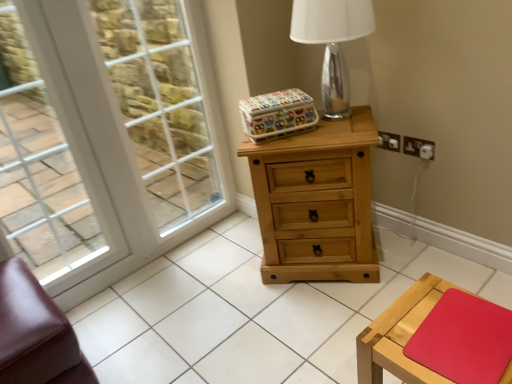
What is the approximate width of natural wood chest of drawers at center?

The width of natural wood chest of drawers at center is 16.77 inches.

This screenshot has width=512, height=384. Find the location of `white plastic electrical outlet at upper right, which is counted as the 1th electric outlet, starting from the right`. white plastic electrical outlet at upper right, which is counted as the 1th electric outlet, starting from the right is located at coordinates (418, 148).

Image resolution: width=512 pixels, height=384 pixels. Describe the element at coordinates (35, 333) in the screenshot. I see `brown leather ottoman at lower left` at that location.

This screenshot has height=384, width=512. What are the coordinates of `wooden table at lower right` in the screenshot? It's located at (400, 335).

At what (x,y) coordinates should I click in order to perform the action: click on natural wood tile at center. Please return your answer as a coordinate pair (x, y). Image resolution: width=512 pixels, height=384 pixels. Looking at the image, I should click on (251, 312).

This screenshot has height=384, width=512. Identify the location of electric outlet on the right of the white plastic electrical outlet at upper right, the 2th electric outlet from the right. (418, 148).

Is white plastic electrical outlet at upper right, the 2th electric outlet from the right, aimed at white plastic electrical outlet at upper right, which is counted as the second electric outlet, starting from the left?

No.

Considering the relative sizes of white plastic electrical outlet at upper right, marked as the first electric outlet in a left-to-right arrangement, and white plastic electrical outlet at upper right, which is counted as the 1th electric outlet, starting from the right, in the image provided, is white plastic electrical outlet at upper right, marked as the first electric outlet in a left-to-right arrangement, shorter than white plastic electrical outlet at upper right, which is counted as the 1th electric outlet, starting from the right,?

No, white plastic electrical outlet at upper right, marked as the first electric outlet in a left-to-right arrangement, is not shorter than white plastic electrical outlet at upper right, which is counted as the 1th electric outlet, starting from the right.

Is white plastic electrical outlet at upper right, the 2th electric outlet from the right, directly adjacent to white plastic electrical outlet at upper right, which is counted as the second electric outlet, starting from the left?

Yes, white plastic electrical outlet at upper right, the 2th electric outlet from the right, and white plastic electrical outlet at upper right, which is counted as the second electric outlet, starting from the left, clearly make contact.

Looking at this image, who is bigger, wooden table at lower right or white plastic electrical outlet at upper right, the 2th electric outlet from the right?

wooden table at lower right is bigger.

Consider the image. From the image's perspective, would you say wooden table at lower right is positioned over white plastic electrical outlet at upper right, the 2th electric outlet from the right?

No, from the image's perspective, wooden table at lower right is not above white plastic electrical outlet at upper right, the 2th electric outlet from the right.

In terms of height, does wooden table at lower right look taller or shorter compared to white plastic electrical outlet at upper right, the 2th electric outlet from the right?

In the image, wooden table at lower right appears to be taller than white plastic electrical outlet at upper right, the 2th electric outlet from the right.

From a real-world perspective, relative to white plastic electrical outlet at upper right, the 2th electric outlet from the right, is wooden table at lower right vertically above or below?

Clearly, from a real-world perspective, wooden table at lower right is below white plastic electrical outlet at upper right, the 2th electric outlet from the right.

Is natural wood tile at center not within white plastic electrical outlet at upper right, marked as the first electric outlet in a left-to-right arrangement?

Absolutely, natural wood tile at center is external to white plastic electrical outlet at upper right, marked as the first electric outlet in a left-to-right arrangement.

From the image's perspective, is natural wood tile at center on top of white plastic electrical outlet at upper right, the 2th electric outlet from the right?

No.

From a real-world perspective, who is located lower, natural wood tile at center or white plastic electrical outlet at upper right, the 2th electric outlet from the right?

In real-world perspective, natural wood tile at center is lower.

Can you confirm if transparent glass table lamp at upper center is wider than white plastic electrical outlet at upper right, the 2th electric outlet from the right?

Yes, transparent glass table lamp at upper center is wider than white plastic electrical outlet at upper right, the 2th electric outlet from the right.

Is transparent glass table lamp at upper center turned away from white plastic electrical outlet at upper right, the 2th electric outlet from the right?

No, white plastic electrical outlet at upper right, the 2th electric outlet from the right, is not at the back of transparent glass table lamp at upper center.

Does point (312, 39) lie in front of point (380, 141)?

That is True.

Are wooden table at lower right and white plastic electrical outlet at upper right, which is counted as the second electric outlet, starting from the left, located far from each other?

That's not correct — wooden table at lower right is a little close to white plastic electrical outlet at upper right, which is counted as the second electric outlet, starting from the left.

The height and width of the screenshot is (384, 512). Identify the location of table located in front of the white plastic electrical outlet at upper right, which is counted as the second electric outlet, starting from the left. (400, 335).

Considering the sizes of objects wooden table at lower right and white plastic electrical outlet at upper right, which is counted as the 1th electric outlet, starting from the right, in the image provided, who is shorter, wooden table at lower right or white plastic electrical outlet at upper right, which is counted as the 1th electric outlet, starting from the right,?

Standing shorter between the two is white plastic electrical outlet at upper right, which is counted as the 1th electric outlet, starting from the right.

Would you say natural wood tile at center is outside natural wood chest of drawers at center?

That's correct, natural wood tile at center is outside of natural wood chest of drawers at center.

Is natural wood tile at center behind natural wood chest of drawers at center?

That is False.

What's the angular difference between natural wood tile at center and natural wood chest of drawers at center's facing directions?

The facing directions of natural wood tile at center and natural wood chest of drawers at center are 39.6 degrees apart.

From a real-world perspective, is natural wood tile at center located beneath natural wood chest of drawers at center?

Indeed, from a real-world perspective, natural wood tile at center is positioned beneath natural wood chest of drawers at center.

Between white glass window screen at upper left and transparent glass table lamp at upper center, which one appears on the left side from the viewer's perspective?

white glass window screen at upper left.

Which of these two, white glass window screen at upper left or transparent glass table lamp at upper center, stands shorter?

transparent glass table lamp at upper center.

Is white glass window screen at upper left positioned with its back to transparent glass table lamp at upper center?

No, white glass window screen at upper left is not facing the opposite direction of transparent glass table lamp at upper center.

Is white glass window screen at upper left not inside transparent glass table lamp at upper center?

Yes, white glass window screen at upper left is not within transparent glass table lamp at upper center.

The width and height of the screenshot is (512, 384). I want to click on electric outlet positioned vertically above the white plastic electrical outlet at upper right, which is counted as the second electric outlet, starting from the left (from a real-world perspective), so click(x=389, y=141).

Where is `table directly beneath the white plastic electrical outlet at upper right, marked as the first electric outlet in a left-to-right arrangement (from a real-world perspective)`? table directly beneath the white plastic electrical outlet at upper right, marked as the first electric outlet in a left-to-right arrangement (from a real-world perspective) is located at coordinates pyautogui.click(x=400, y=335).

Considering their positions, is brown leather ottoman at lower left positioned further to natural wood tile at center than white glass window screen at upper left?

Among the two, white glass window screen at upper left is located further to natural wood tile at center.

Considering their positions, is wooden table at lower right positioned closer to brown leather ottoman at lower left than white glass window at left?

white glass window at left is positioned closer to the anchor brown leather ottoman at lower left.

When comparing their distances from transparent glass table lamp at upper center, does brown leather ottoman at lower left or white plastic electrical outlet at upper right, marked as the first electric outlet in a left-to-right arrangement, seem further?

brown leather ottoman at lower left.

From the picture: Which object lies further to the anchor point natural wood tile at center, white glass window at left or white plastic electrical outlet at upper right, which is counted as the 1th electric outlet, starting from the right?

white plastic electrical outlet at upper right, which is counted as the 1th electric outlet, starting from the right, lies further to natural wood tile at center than the other object.

Estimate the real-world distances between objects in this image. Which object is further from brown leather ottoman at lower left, white glass window screen at upper left or white plastic electrical outlet at upper right, marked as the first electric outlet in a left-to-right arrangement?

white glass window screen at upper left.

Based on their spatial positions, is brown leather ottoman at lower left or white glass window at left closer to transparent glass table lamp at upper center?

The object closer to transparent glass table lamp at upper center is white glass window at left.

Considering their positions, is white plastic electrical outlet at upper right, which is counted as the second electric outlet, starting from the left, positioned further to white plastic electrical outlet at upper right, the 2th electric outlet from the right, than wooden table at lower right?

Based on the image, wooden table at lower right appears to be further to white plastic electrical outlet at upper right, the 2th electric outlet from the right.

Considering their positions, is white plastic electrical outlet at upper right, marked as the first electric outlet in a left-to-right arrangement, positioned further to transparent glass table lamp at upper center than white glass window screen at upper left?

Based on the image, white glass window screen at upper left appears to be further to transparent glass table lamp at upper center.

The width and height of the screenshot is (512, 384). I want to click on chest of drawers between wooden table at lower right and white plastic electrical outlet at upper right, which is counted as the second electric outlet, starting from the left, in the front-back direction, so click(x=316, y=202).

This screenshot has width=512, height=384. In order to click on table lamp between white glass window at left and white plastic electrical outlet at upper right, marked as the first electric outlet in a left-to-right arrangement, in the horizontal direction in this screenshot , I will do (x=332, y=43).

Where is `electric outlet located between natural wood tile at center and white plastic electrical outlet at upper right, marked as the first electric outlet in a left-to-right arrangement, in the depth direction`? The width and height of the screenshot is (512, 384). electric outlet located between natural wood tile at center and white plastic electrical outlet at upper right, marked as the first electric outlet in a left-to-right arrangement, in the depth direction is located at coordinates (418, 148).

The image size is (512, 384). I want to click on tile between brown leather ottoman at lower left and white plastic electrical outlet at upper right, which is counted as the second electric outlet, starting from the left, so click(251, 312).